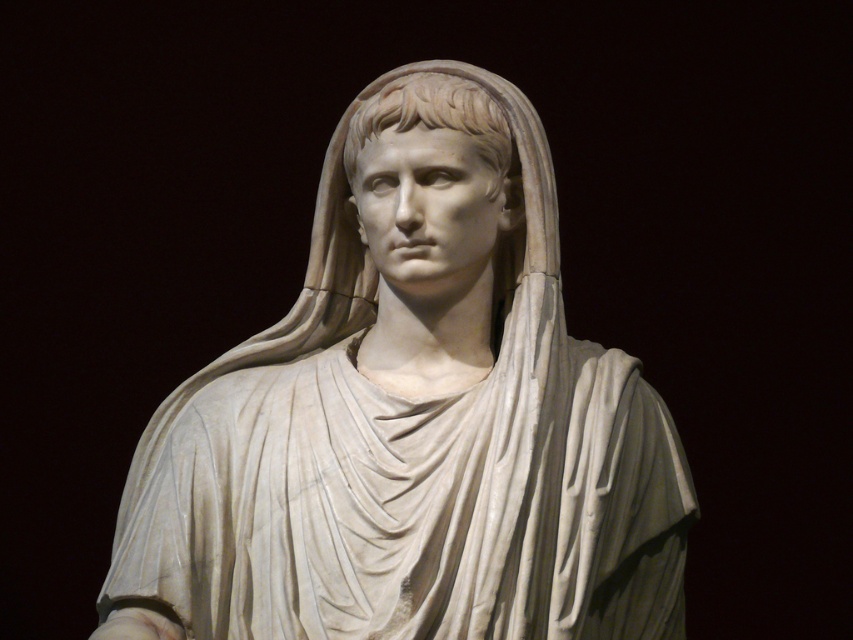
Question: Is white marble statue at center thinner than white marble head at center?

Choices:
 (A) yes
 (B) no

Answer: (B)

Question: Is white marble statue at center further to the viewer compared to white marble head at center?

Choices:
 (A) no
 (B) yes

Answer: (A)

Question: Does white marble statue at center have a smaller size compared to white marble head at center?

Choices:
 (A) yes
 (B) no

Answer: (B)